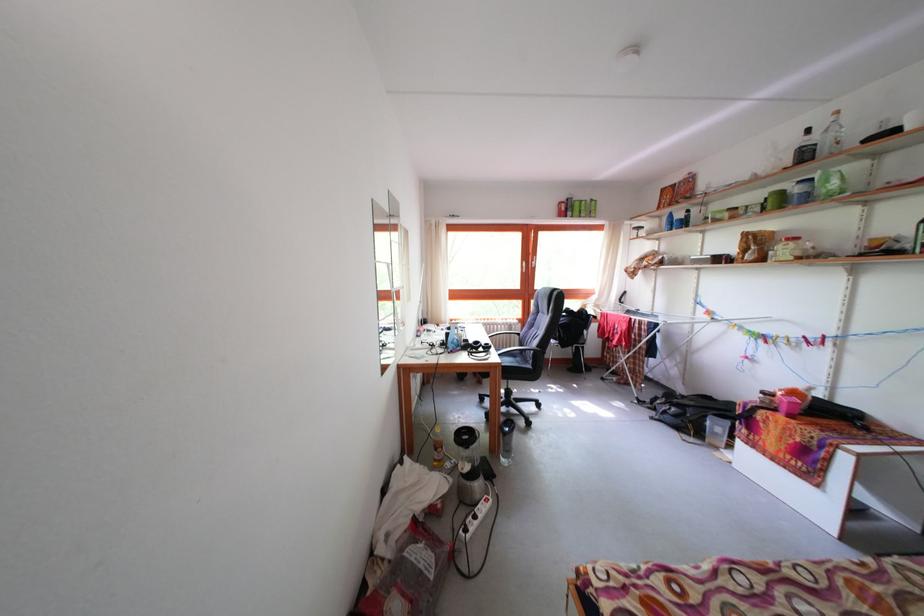
The height and width of the screenshot is (616, 924). I want to click on black chair armrest, so click(x=517, y=349).